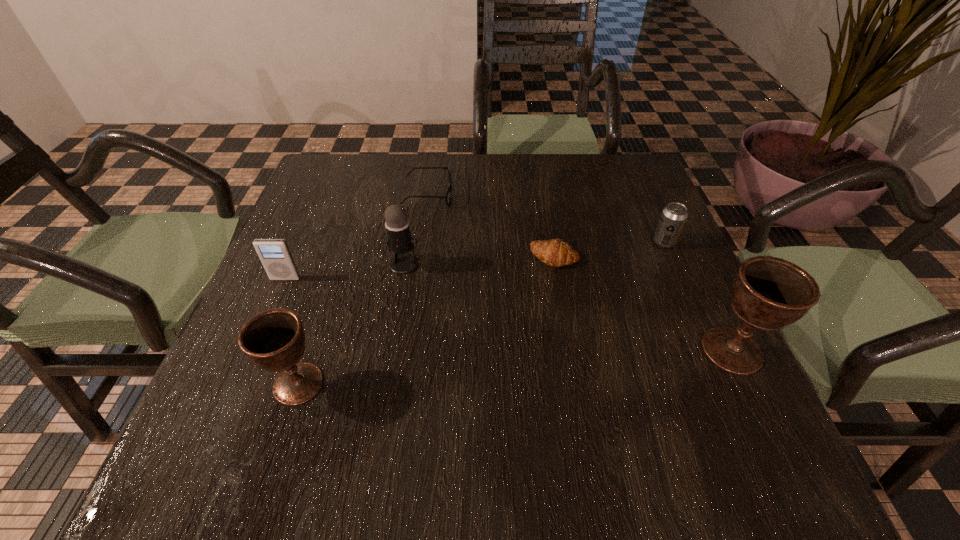
Where is `blank area in the image that satisfies the following two spatial constraints: 1. on the front side of the beer can; 2. on the left side of the taller chalice`? This screenshot has height=540, width=960. blank area in the image that satisfies the following two spatial constraints: 1. on the front side of the beer can; 2. on the left side of the taller chalice is located at coordinates (711, 350).

Identify the location of blank space that satisfies the following two spatial constraints: 1. on the front-facing side of the farthest object; 2. on the back side of the beer can. (421, 242).

I want to click on vacant space that satisfies the following two spatial constraints: 1. on the front-facing side of the spectacles; 2. on the left side of the beer can, so click(x=421, y=242).

Image resolution: width=960 pixels, height=540 pixels. I want to click on free space in the image that satisfies the following two spatial constraints: 1. on the front-facing side of the farthest object; 2. on the front-facing side of the fifth farthest object, so click(x=417, y=279).

Locate an element on the screen. This screenshot has width=960, height=540. free location that satisfies the following two spatial constraints: 1. on the back side of the third object from right to left; 2. on the front-facing side of the farthest object is located at coordinates (544, 194).